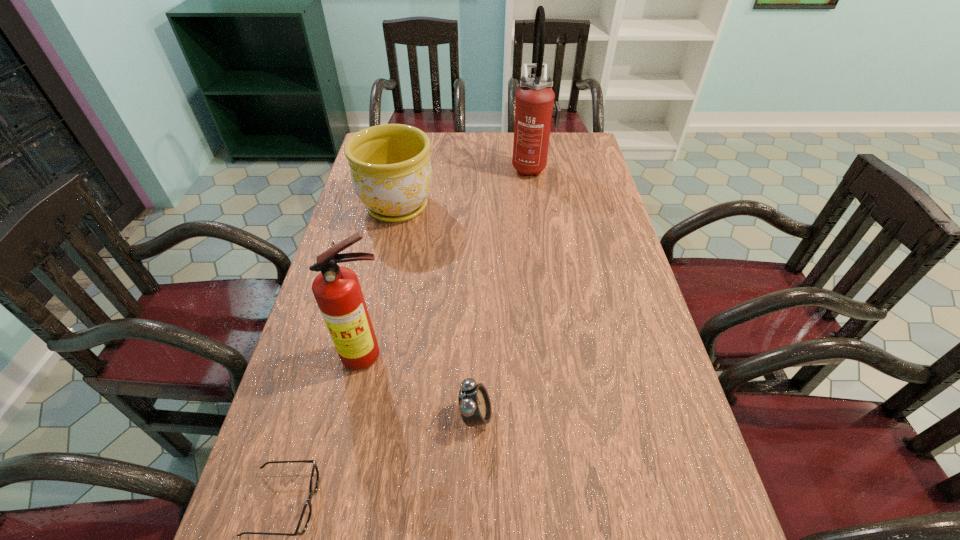
Identify the location of free space located 0.080m at the nozzle of the tallest object. Image resolution: width=960 pixels, height=540 pixels. (490, 166).

Locate an element on the screen. vacant space located 0.280m on the front-facing side of the second tallest object is located at coordinates (337, 502).

I want to click on free spot located on the right of the third tallest object, so [481, 206].

Find the location of a particular element. The image size is (960, 540). vacant space located 0.350m on the face of the alarm clock is located at coordinates (654, 415).

In order to click on object that is positioned at the far edge in this screenshot , I will do `click(535, 108)`.

Where is `fire extinguisher located at the left edge`? Image resolution: width=960 pixels, height=540 pixels. fire extinguisher located at the left edge is located at coordinates (337, 291).

The image size is (960, 540). I want to click on flowerpot at the left edge, so click(x=390, y=167).

I want to click on vacant space at the far edge, so click(434, 156).

In the image, there is a desktop. Where is `free space at the left edge`? free space at the left edge is located at coordinates (360, 265).

What are the coordinates of `free space at the right edge` in the screenshot? It's located at (569, 168).